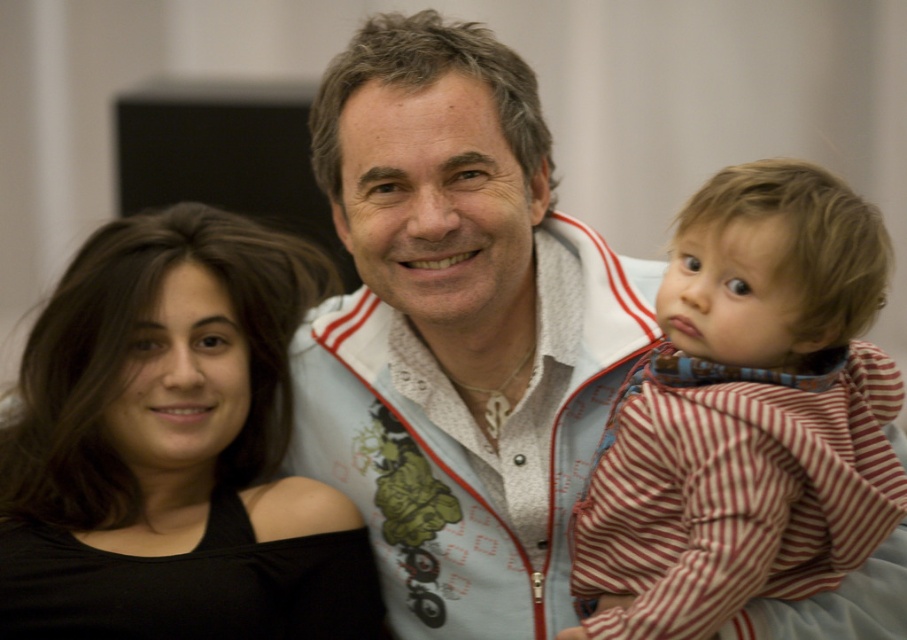
Does black matte shirt at left lie in front of striped cotton shirt at right?

No, black matte shirt at left is further to the viewer.

Describe the element at coordinates (167, 444) in the screenshot. I see `black matte shirt at left` at that location.

This screenshot has width=907, height=640. Find the location of `black matte shirt at left`. black matte shirt at left is located at coordinates (167, 444).

What do you see at coordinates (456, 330) in the screenshot? This screenshot has height=640, width=907. I see `white textured jacket at center` at bounding box center [456, 330].

Can you confirm if white textured jacket at center is thinner than black matte shirt at left?

Yes, white textured jacket at center is thinner than black matte shirt at left.

This screenshot has height=640, width=907. What are the coordinates of `white textured jacket at center` in the screenshot? It's located at (456, 330).

Which is in front, point (530, 625) or point (665, 477)?

Point (665, 477)

Who is shorter, white textured jacket at center or striped cotton shirt at right?

Standing shorter between the two is striped cotton shirt at right.

At what (x,y) coordinates should I click in order to perform the action: click on white textured jacket at center. Please return your answer as a coordinate pair (x, y). This screenshot has width=907, height=640. Looking at the image, I should click on (456, 330).

The height and width of the screenshot is (640, 907). Identify the location of white textured jacket at center. (456, 330).